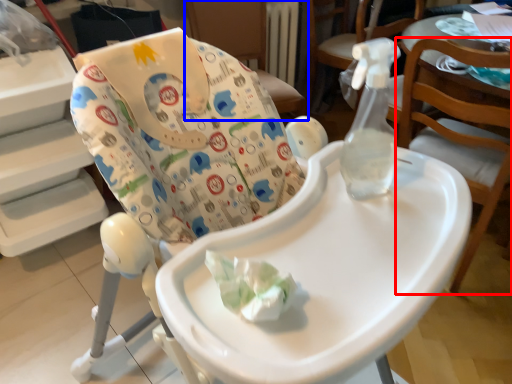
Question: Which object is further to the camera taking this photo, chair (highlighted by a red box) or chair (highlighted by a blue box)?

Choices:
 (A) chair
 (B) chair

Answer: (B)